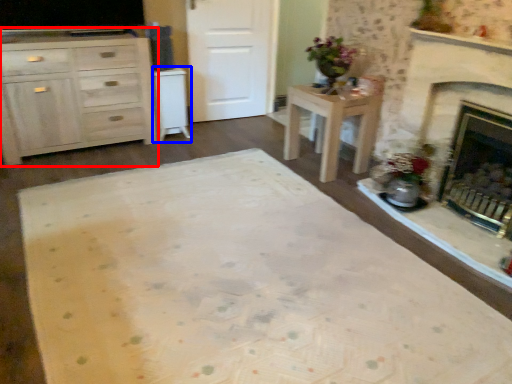
Question: Among these objects, which one is nearest to the camera, cabinetry (highlighted by a red box) or cabinetry (highlighted by a blue box)?

Choices:
 (A) cabinetry
 (B) cabinetry

Answer: (A)